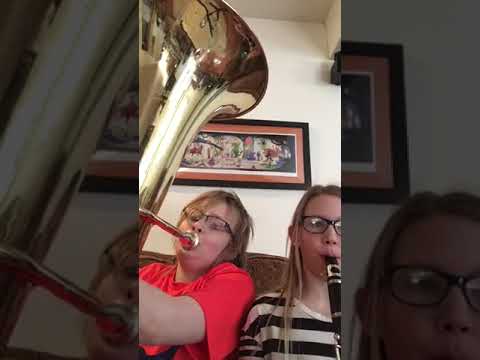
At what (x,y) coordinates should I click in order to perform the action: click on the right of picture frame. Please return your answer as a coordinate pair (x, y). This screenshot has height=360, width=480. Looking at the image, I should click on (408, 47), (409, 85), (411, 128), (414, 186), (308, 123), (311, 143), (312, 161), (314, 183).